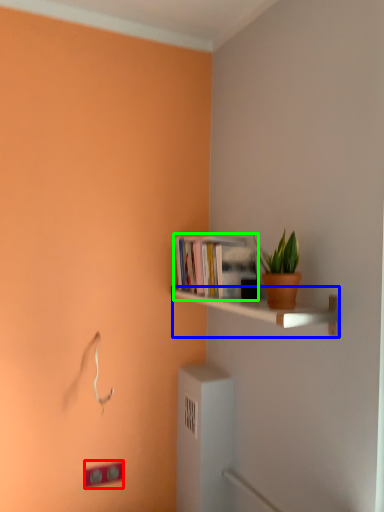
Question: Which object is positioned farthest from light switch (highlighted by a red box)? Select from shelf (highlighted by a blue box) and book (highlighted by a green box).

Choices:
 (A) shelf
 (B) book

Answer: (B)